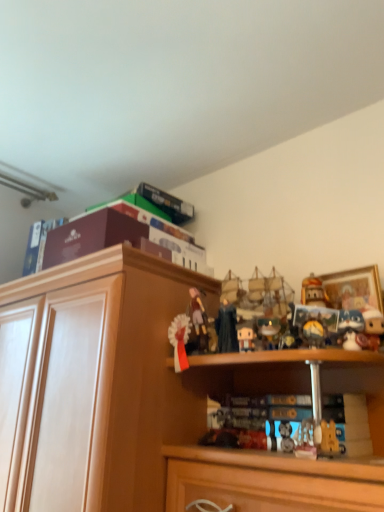
Question: Is white matte figurine at center, positioned as the fourth toy in left-to-right order, bigger than wooden cabinet at upper center?

Choices:
 (A) yes
 (B) no

Answer: (B)

Question: Is white matte figurine at center, which is counted as the 2th toy, starting from the right, in front of wooden cabinet at upper center?

Choices:
 (A) yes
 (B) no

Answer: (B)

Question: From a real-world perspective, is white matte figurine at center, positioned as the fourth toy in left-to-right order, physically above wooden cabinet at upper center?

Choices:
 (A) no
 (B) yes

Answer: (B)

Question: From the image's perspective, is white matte figurine at center, positioned as the fourth toy in left-to-right order, beneath wooden cabinet at upper center?

Choices:
 (A) yes
 (B) no

Answer: (B)

Question: Would you consider white matte figurine at center, positioned as the fourth toy in left-to-right order, to be distant from wooden cabinet at upper center?

Choices:
 (A) no
 (B) yes

Answer: (A)

Question: From the image's perspective, relative to maroon cardboard box at upper left, the fourth book positioned from the right, is white glossy ribbon at center, which ranks as the first toy in left-to-right order, above or below?

Choices:
 (A) above
 (B) below

Answer: (B)

Question: Is white glossy ribbon at center, which ranks as the fifth toy in right-to-left order, to the left or to the right of maroon cardboard box at upper left, which is the first book in left-to-right order, in the image?

Choices:
 (A) left
 (B) right

Answer: (B)

Question: From a real-world perspective, is white glossy ribbon at center, which ranks as the first toy in left-to-right order, physically located above or below maroon cardboard box at upper left, which is the first book in left-to-right order?

Choices:
 (A) above
 (B) below

Answer: (B)

Question: Is point (180, 347) positioned closer to the camera than point (29, 241)?

Choices:
 (A) closer
 (B) farther

Answer: (A)

Question: Does point (374, 272) appear closer or farther from the camera than point (249, 346)?

Choices:
 (A) farther
 (B) closer

Answer: (A)

Question: Is wooden framed picture at upper right to the left or to the right of white matte figurine at center, positioned as the fourth toy in left-to-right order, in the image?

Choices:
 (A) left
 (B) right

Answer: (B)

Question: In terms of width, does wooden framed picture at upper right look wider or thinner when compared to white matte figurine at center, which is counted as the 2th toy, starting from the right?

Choices:
 (A) wide
 (B) thin

Answer: (A)

Question: From a real-world perspective, is wooden framed picture at upper right physically located above or below white matte figurine at center, which is counted as the 2th toy, starting from the right?

Choices:
 (A) above
 (B) below

Answer: (A)

Question: From the image's perspective, relative to maroon cardboard box at upper left, the fourth book positioned from the right, is dark blue fabric figurine at center, the third toy in the left-to-right sequence, above or below?

Choices:
 (A) below
 (B) above

Answer: (A)

Question: Is point (230, 309) closer or farther from the camera than point (57, 225)?

Choices:
 (A) farther
 (B) closer

Answer: (B)